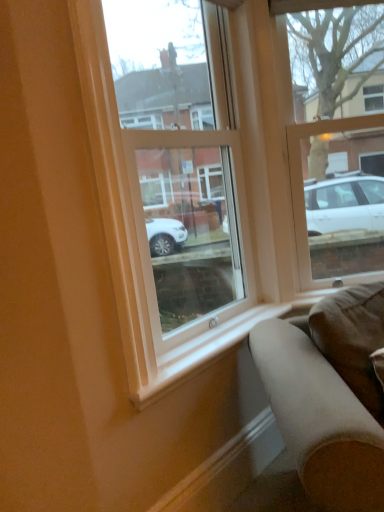
Question: Can you confirm if suede-like brown couch at lower right is thinner than white smooth window sill at lower center?

Choices:
 (A) yes
 (B) no

Answer: (B)

Question: Considering the relative sizes of suede-like brown couch at lower right and white smooth window sill at lower center in the image provided, is suede-like brown couch at lower right shorter than white smooth window sill at lower center?

Choices:
 (A) no
 (B) yes

Answer: (A)

Question: Does suede-like brown couch at lower right appear on the left side of white smooth window sill at lower center?

Choices:
 (A) no
 (B) yes

Answer: (A)

Question: From the image's perspective, would you say suede-like brown couch at lower right is shown under white smooth window sill at lower center?

Choices:
 (A) no
 (B) yes

Answer: (B)

Question: From the image's perspective, is suede-like brown couch at lower right on white smooth window sill at lower center?

Choices:
 (A) yes
 (B) no

Answer: (B)

Question: Visually, is suede-like brown couch at lower right positioned to the left or to the right of smooth wood curb at lower center?

Choices:
 (A) right
 (B) left

Answer: (A)

Question: Is suede-like brown couch at lower right in front of or behind smooth wood curb at lower center in the image?

Choices:
 (A) behind
 (B) front

Answer: (B)

Question: From the image's perspective, is suede-like brown couch at lower right positioned above or below smooth wood curb at lower center?

Choices:
 (A) above
 (B) below

Answer: (A)

Question: In terms of width, does suede-like brown couch at lower right look wider or thinner when compared to smooth wood curb at lower center?

Choices:
 (A) thin
 (B) wide

Answer: (B)

Question: In the image, is smooth wood curb at lower center on the left side or the right side of clear glass window at upper right, the first window viewed from the right?

Choices:
 (A) right
 (B) left

Answer: (B)

Question: Considering the positions of smooth wood curb at lower center and clear glass window at upper right, the 2th window in the left-to-right sequence, in the image, is smooth wood curb at lower center taller or shorter than clear glass window at upper right, the 2th window in the left-to-right sequence,?

Choices:
 (A) tall
 (B) short

Answer: (B)

Question: Is smooth wood curb at lower center inside the boundaries of clear glass window at upper right, the 2th window in the left-to-right sequence, or outside?

Choices:
 (A) outside
 (B) inside

Answer: (A)

Question: In terms of width, does smooth wood curb at lower center look wider or thinner when compared to clear glass window at upper right, the 2th window in the left-to-right sequence?

Choices:
 (A) wide
 (B) thin

Answer: (B)

Question: Considering the positions of transparent glass window at center, which appears as the 1th window when viewed from the left, and brown suede pillow at lower right in the image, is transparent glass window at center, which appears as the 1th window when viewed from the left, bigger or smaller than brown suede pillow at lower right?

Choices:
 (A) big
 (B) small

Answer: (A)

Question: From the image's perspective, relative to brown suede pillow at lower right, is transparent glass window at center, which appears as the 1th window when viewed from the left, above or below?

Choices:
 (A) above
 (B) below

Answer: (A)